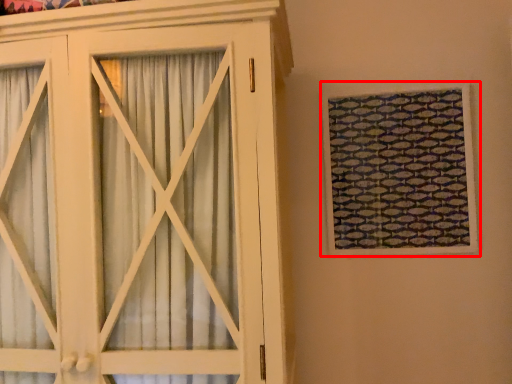
Question: Considering the relative positions of window (annotated by the red box) and cupboard in the image provided, where is window (annotated by the red box) located with respect to the staircase?

Choices:
 (A) right
 (B) left

Answer: (A)